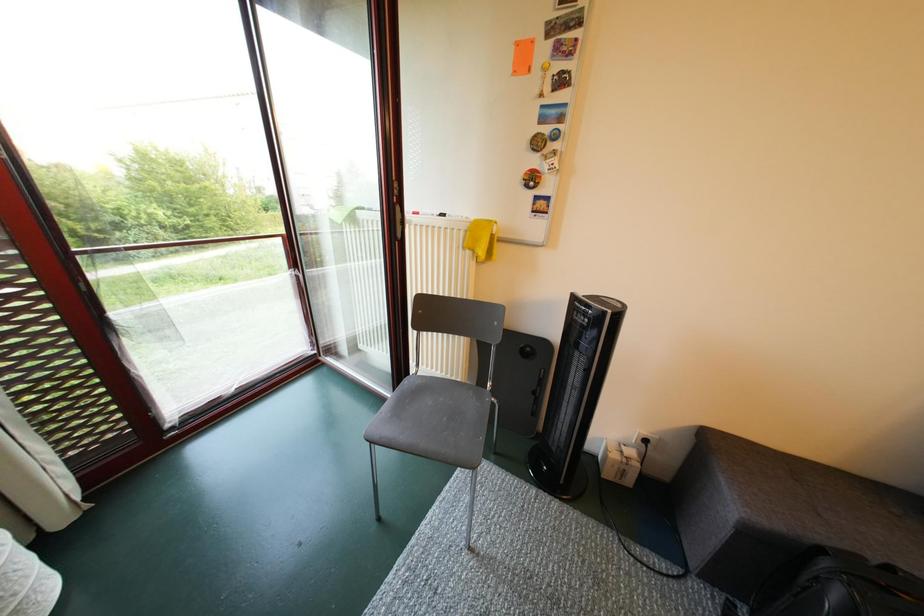
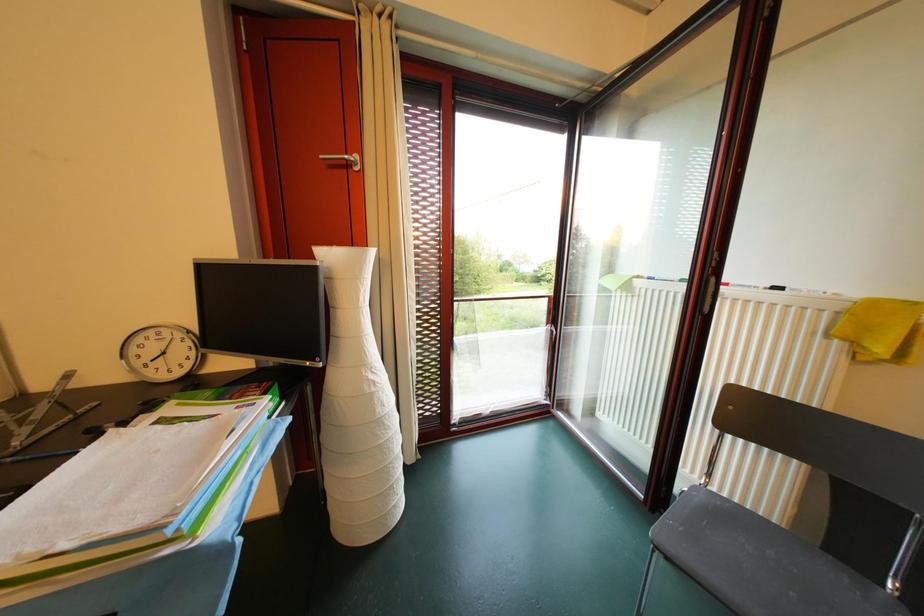
Question: The images are taken continuously from a first-person perspective. In which direction is your viewpoint rotating?

Choices:
 (A) Left
 (B) Right
 (C) Up
 (D) Down

Answer: (A)